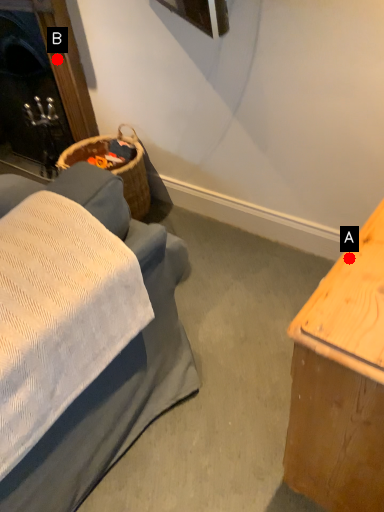
Question: Two points are circled on the image, labeled by A and B beside each circle. Which point appears closest to the camera in this image?

Choices:
 (A) A is closer
 (B) B is closer

Answer: (A)